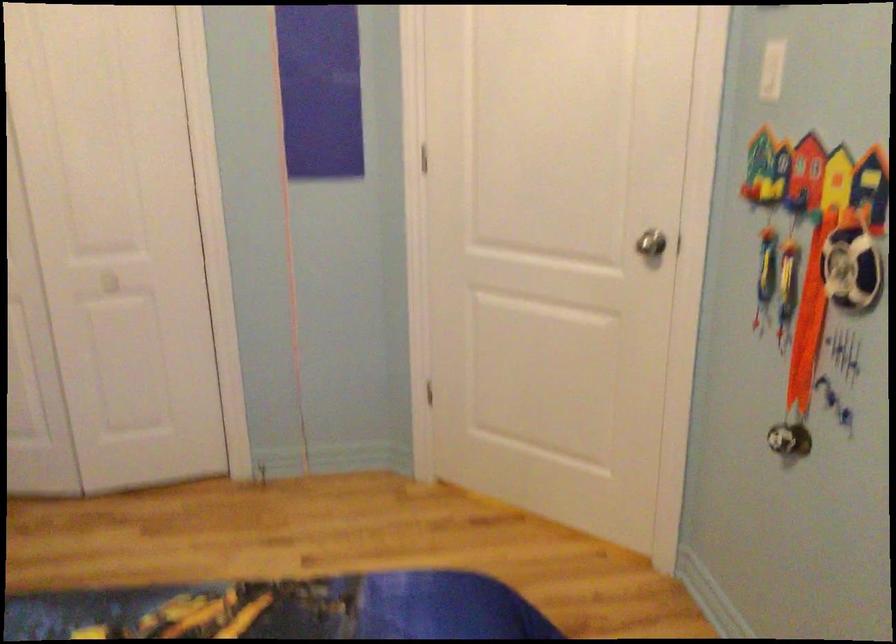
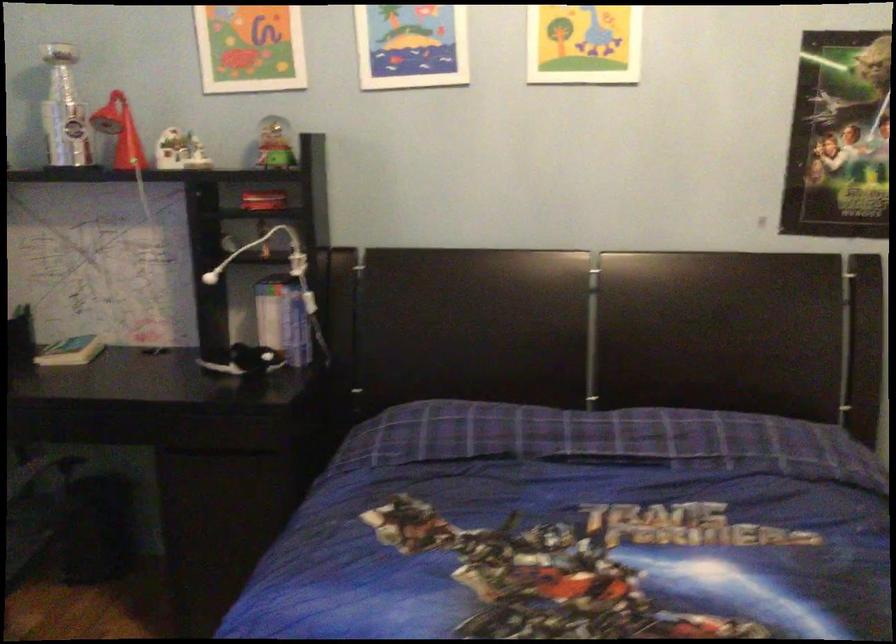
From the picture: The first image is from the beginning of the video and the second image is from the end. How did the camera likely rotate when shooting the video?

The camera rotated toward left-down.